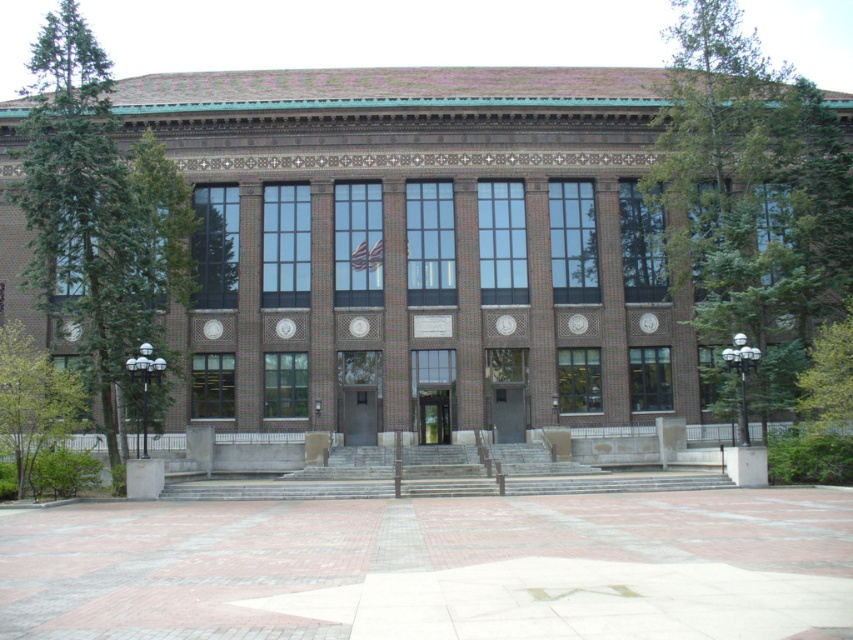
You are standing in front of the building and want to plant a new tree between the green coniferous tree at left and the green leafy tree at lower left. Is there space between them to plant the new tree?

The green coniferous tree at left is to the left of green leafy tree at lower left, so there is space between them to plant the new tree.

You are standing in front of the building and want to know if the green leafy tree at upper right is positioned higher up compared to the green coniferous tree at left. Can you determine this based on the scene?

The green leafy tree at upper right is above the green coniferous tree at left, so yes, it is positioned higher up.